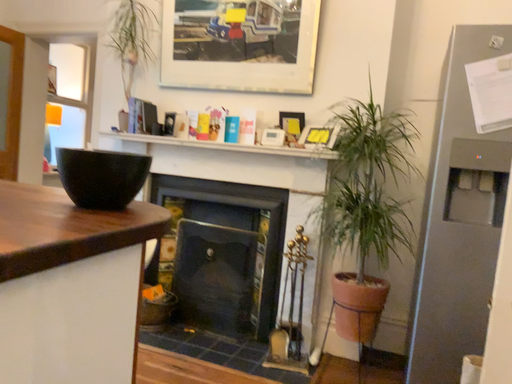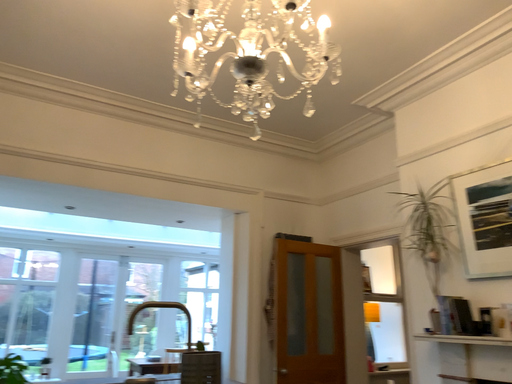
Question: How did the camera likely rotate when shooting the video?

Choices:
 (A) rotated downward
 (B) rotated upward

Answer: (B)